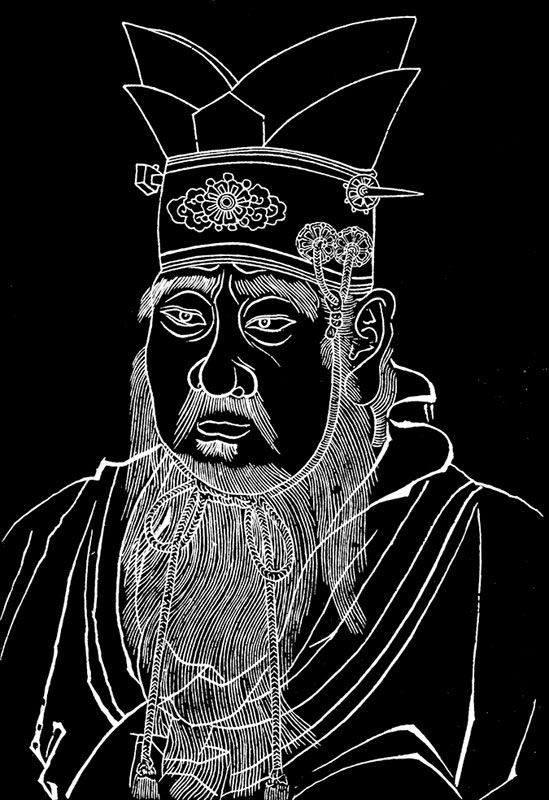
Image resolution: width=549 pixels, height=800 pixels. I want to click on robe, so click(x=500, y=558).